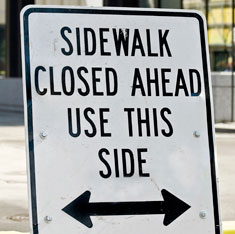
Locate an element on the screen. The height and width of the screenshot is (234, 235). plant in background is located at coordinates (224, 36).